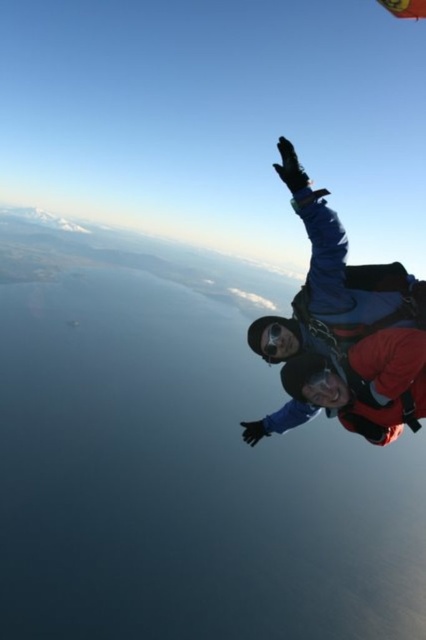
Is point (287, 417) farther from camera compared to point (408, 1)?

No.

Does point (302, 172) come behind point (423, 10)?

No.

The width and height of the screenshot is (426, 640). What are the coordinates of `blue fabric parachute at right` in the screenshot? It's located at (333, 284).